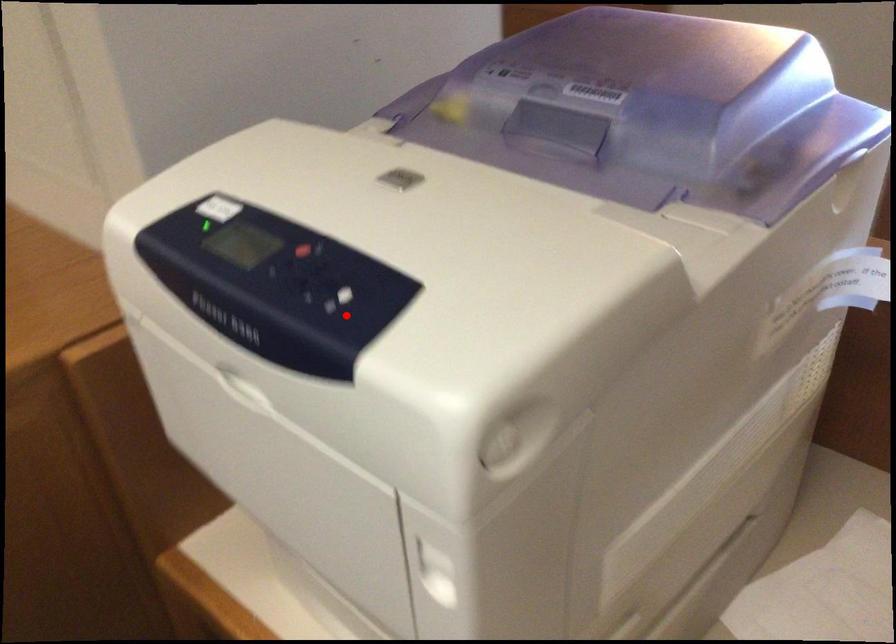
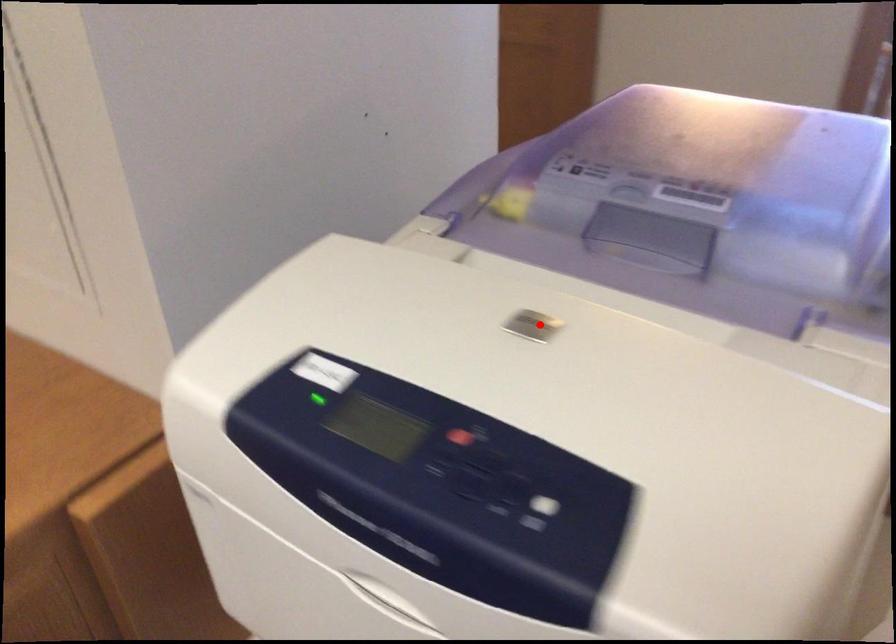
I am providing you with two images of the same scene from different viewpoints. A red point is marked on the first image and another point is marked on the second image. Do the highlighted points in image1 and image2 indicate the same real-world spot?

No